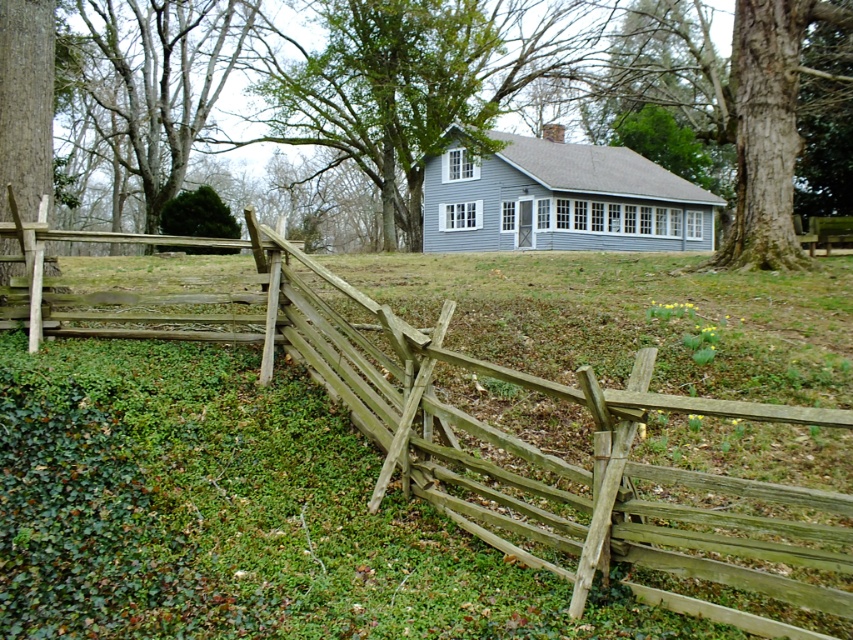
You are a painter standing at the base of the smooth gray bark tree at upper left. You want to paint the weathered wood fence at center but need to know if you can see it clearly from your current position. Can you see the entire fence without any obstruction?

The weathered wood fence at center is not as tall as the smooth gray bark tree at upper left, so yes, you can see the entire fence without obstruction from your position at the base of the tree.